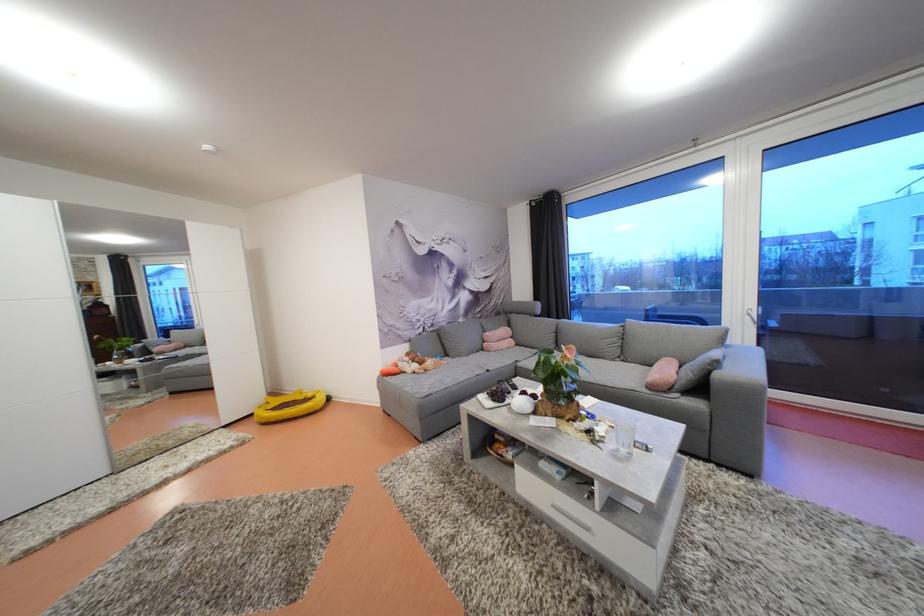
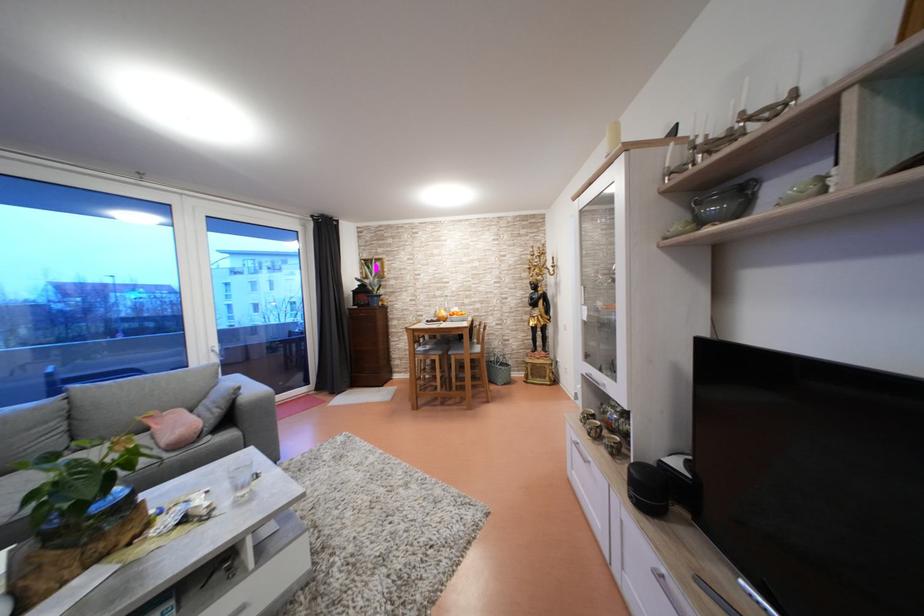
Locate, in the second image, the point that corresponds to the point at 687,371 in the first image.

(199, 418)